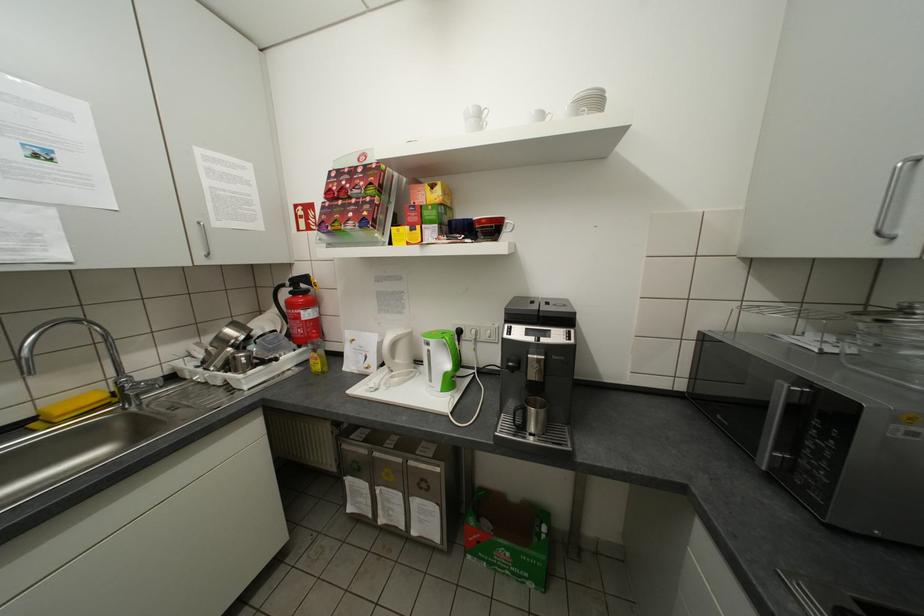
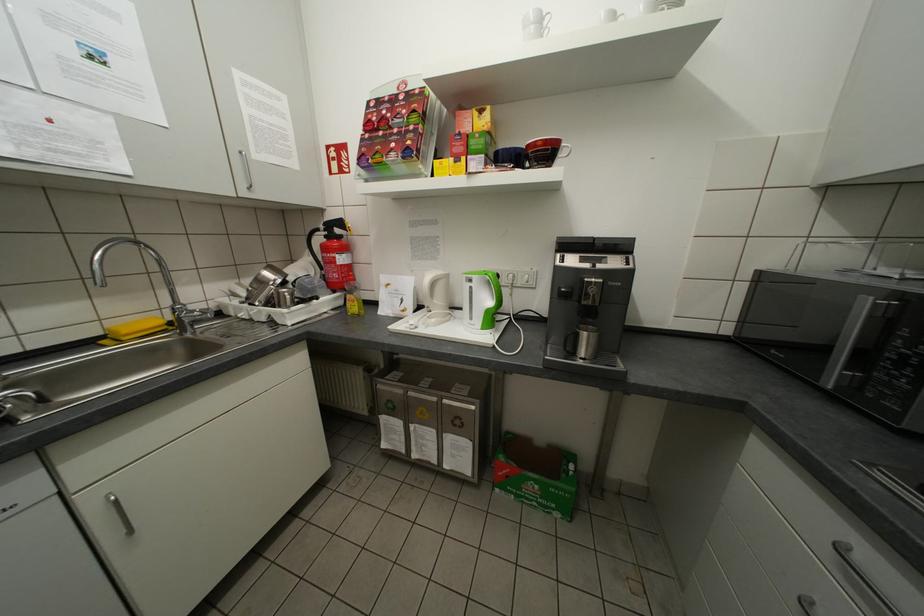
Locate, in the second image, the point that corresponds to the point at 321,362 in the first image.

(357, 305)